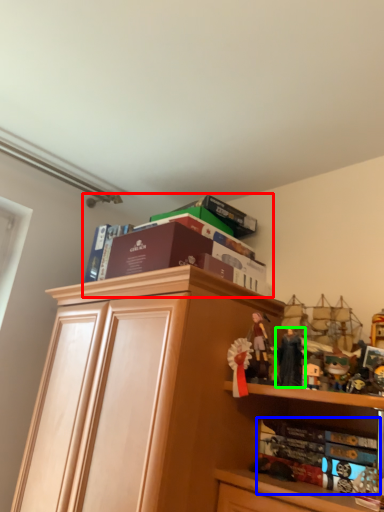
Question: Considering the real-world distances, which object is closest to book (highlighted by a red box)? book (highlighted by a blue box) or toy (highlighted by a green box).

Choices:
 (A) book
 (B) toy

Answer: (B)